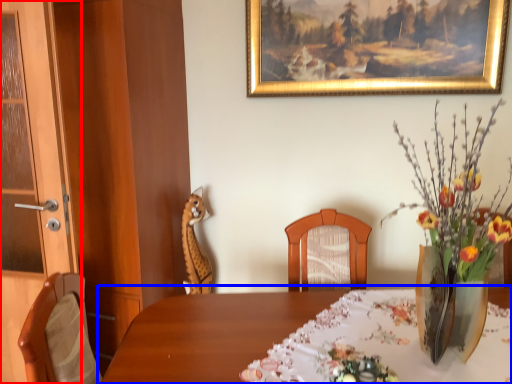
Question: Which object is closer to the camera taking this photo, door (highlighted by a red box) or table (highlighted by a blue box)?

Choices:
 (A) door
 (B) table

Answer: (B)